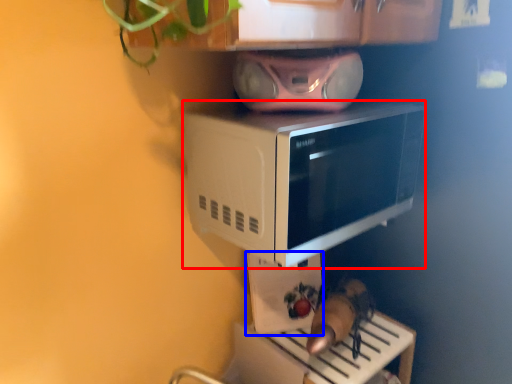
Question: Which object is closer to the camera taking this photo, microwave oven (highlighted by a red box) or appliance (highlighted by a blue box)?

Choices:
 (A) microwave oven
 (B) appliance

Answer: (A)